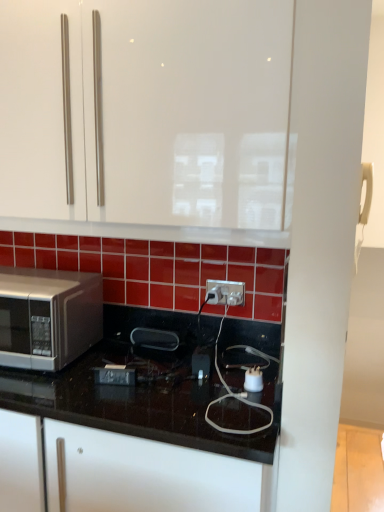
I want to click on white glossy cabinet at upper center, so tap(150, 120).

This screenshot has height=512, width=384. What are the coordinates of `black glossy countertop at lower left` in the screenshot? It's located at (141, 400).

The height and width of the screenshot is (512, 384). Describe the element at coordinates (225, 292) in the screenshot. I see `white plastic electric outlet at center` at that location.

In the scene shown: What is the approximate height of white plastic electric outlet at center?

3.52 inches.

The height and width of the screenshot is (512, 384). Identify the location of white glossy cabinet at upper center. (150, 120).

Is black glossy countertop at lower left inside or outside of satin silver microwave at left?

black glossy countertop at lower left exists outside the volume of satin silver microwave at left.

Which is more to the left, black glossy countertop at lower left or satin silver microwave at left?

satin silver microwave at left.

Between black glossy countertop at lower left and satin silver microwave at left, which one has larger size?

black glossy countertop at lower left is bigger.

Is satin silver microwave at left at the back of black glossy countertop at lower left?

black glossy countertop at lower left is not turned away from satin silver microwave at left.

Would you say satin silver microwave at left is outside white glossy cabinet at upper center?

Yes, satin silver microwave at left is located beyond the bounds of white glossy cabinet at upper center.

Does point (73, 353) lie behind point (30, 112)?

Yes, point (73, 353) is farther from viewer.

From the image's perspective, is satin silver microwave at left over white glossy cabinet at upper center?

Actually, satin silver microwave at left appears below white glossy cabinet at upper center in the image.

Can you confirm if black glossy countertop at lower left is smaller than white plastic electric outlet at center?

No.

Is black glossy countertop at lower left wider than white plastic electric outlet at center?

Yes.

Does point (140, 400) lie in front of point (243, 298)?

Yes.

From the image's perspective, which is below, white plastic electric outlet at center or black glossy countertop at lower left?

black glossy countertop at lower left.

Based on the photo, is white plastic electric outlet at center positioned beyond the bounds of black glossy countertop at lower left?

Yes, white plastic electric outlet at center is outside of black glossy countertop at lower left.

Which object is positioned more to the right, satin silver microwave at left or black glossy countertop at lower left?

black glossy countertop at lower left is more to the right.

Which of these two, satin silver microwave at left or black glossy countertop at lower left, is wider?

With larger width is black glossy countertop at lower left.

Consider the image. Is satin silver microwave at left far from black glossy countertop at lower left?

No, satin silver microwave at left is in close proximity to black glossy countertop at lower left.

From a real-world perspective, does white plastic electric outlet at center sit lower than satin silver microwave at left?

No, from a real-world perspective, white plastic electric outlet at center is not beneath satin silver microwave at left.

Which of these two, white plastic electric outlet at center or satin silver microwave at left, stands taller?

With more height is satin silver microwave at left.

Looking at this image, from the image's perspective, would you say white plastic electric outlet at center is positioned over satin silver microwave at left?

Yes, from the image's perspective, white plastic electric outlet at center is on top of satin silver microwave at left.

Measure the distance between white plastic electric outlet at center and satin silver microwave at left.

white plastic electric outlet at center and satin silver microwave at left are 56.11 centimeters apart from each other.

Is black glossy countertop at lower left at the left side of white glossy cabinet at upper center?

Indeed, black glossy countertop at lower left is positioned on the left side of white glossy cabinet at upper center.

Find the location of a particular element. This screenshot has height=512, width=384. cabinetry positioned vertically above the black glossy countertop at lower left (from a real-world perspective) is located at coordinates (150, 120).

How far apart are black glossy countertop at lower left and white glossy cabinet at upper center?

black glossy countertop at lower left and white glossy cabinet at upper center are 26.36 inches apart.

In the scene shown: Looking at the image, does black glossy countertop at lower left seem bigger or smaller compared to white glossy cabinet at upper center?

black glossy countertop at lower left is bigger than white glossy cabinet at upper center.

The image size is (384, 512). Identify the location of microwave oven above the black glossy countertop at lower left (from a real-world perspective). (48, 317).

The image size is (384, 512). In order to click on cabinetry above the satin silver microwave at left (from the image's perspective) in this screenshot , I will do `click(150, 120)`.

Considering their positions, is satin silver microwave at left positioned further to white glossy cabinet at upper center than black glossy countertop at lower left?

black glossy countertop at lower left.

From the image, which object appears to be nearer to white plastic electric outlet at center, black glossy countertop at lower left or white glossy cabinet at upper center?

black glossy countertop at lower left is closer to white plastic electric outlet at center.

Which object lies further to the anchor point black glossy countertop at lower left, white glossy cabinet at upper center or white plastic electric outlet at center?

white glossy cabinet at upper center lies further to black glossy countertop at lower left than the other object.

Which object lies nearer to the anchor point satin silver microwave at left, white glossy cabinet at upper center or black glossy countertop at lower left?

Among the two, black glossy countertop at lower left is located nearer to satin silver microwave at left.

Looking at the image, which one is located closer to satin silver microwave at left, black glossy countertop at lower left or white plastic electric outlet at center?

The object closer to satin silver microwave at left is black glossy countertop at lower left.

From the image, which object appears to be nearer to white glossy cabinet at upper center, black glossy countertop at lower left or satin silver microwave at left?

The object closer to white glossy cabinet at upper center is satin silver microwave at left.

Considering their positions, is black glossy countertop at lower left positioned further to satin silver microwave at left than white glossy cabinet at upper center?

Based on the image, white glossy cabinet at upper center appears to be further to satin silver microwave at left.

Estimate the real-world distances between objects in this image. Which object is further from white glossy cabinet at upper center, satin silver microwave at left or white plastic electric outlet at center?

The object further to white glossy cabinet at upper center is white plastic electric outlet at center.

The height and width of the screenshot is (512, 384). Identify the location of microwave oven between white glossy cabinet at upper center and black glossy countertop at lower left vertically. (48, 317).

Find the location of a particular element. Image resolution: width=384 pixels, height=512 pixels. electric outlet between white glossy cabinet at upper center and satin silver microwave at left vertically is located at coordinates (225, 292).

Where is `electric outlet between white glossy cabinet at upper center and black glossy countertop at lower left vertically`? The image size is (384, 512). electric outlet between white glossy cabinet at upper center and black glossy countertop at lower left vertically is located at coordinates [x=225, y=292].

What are the coordinates of `countertop situated between satin silver microwave at left and white plastic electric outlet at center from left to right` in the screenshot? It's located at (141, 400).